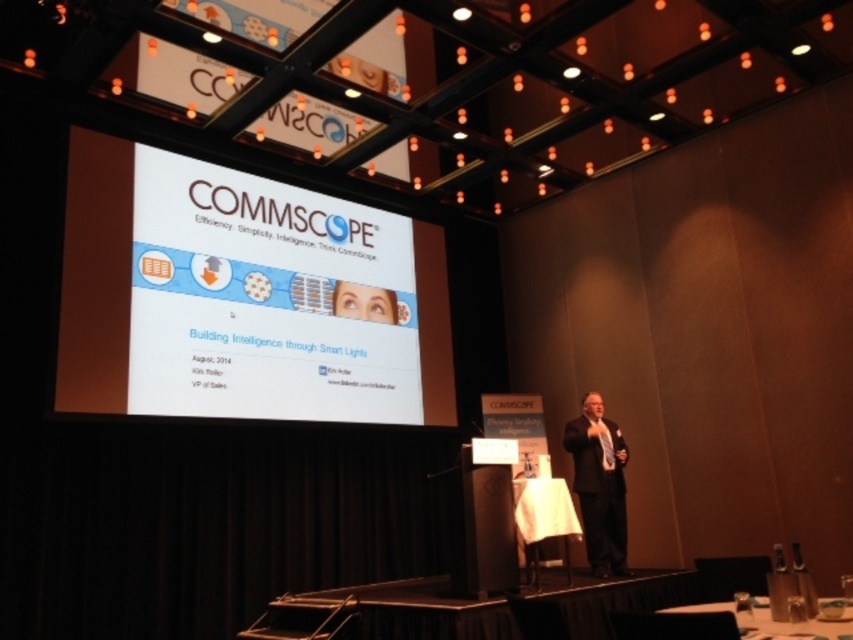
Question: From the image, what is the correct spatial relationship of black suit at center in relation to black plastic table at lower right?

Choices:
 (A) left
 (B) right

Answer: (B)

Question: Which object is closer to the camera taking this photo?

Choices:
 (A) white glossy projection screen at upper center
 (B) black plastic table at lower right

Answer: (B)

Question: Which object is the closest to the black plastic table at lower right?

Choices:
 (A) white cloth at center
 (B) white glossy projection screen at upper center

Answer: (A)

Question: Which is nearer to the black plastic table at lower right?

Choices:
 (A) white glossy projection screen at upper center
 (B) white cloth at center

Answer: (B)

Question: Can you confirm if white glossy projection screen at upper center is smaller than black plastic table at lower right?

Choices:
 (A) no
 (B) yes

Answer: (A)

Question: Is white glossy projection screen at upper center wider than white cloth at center?

Choices:
 (A) no
 (B) yes

Answer: (B)